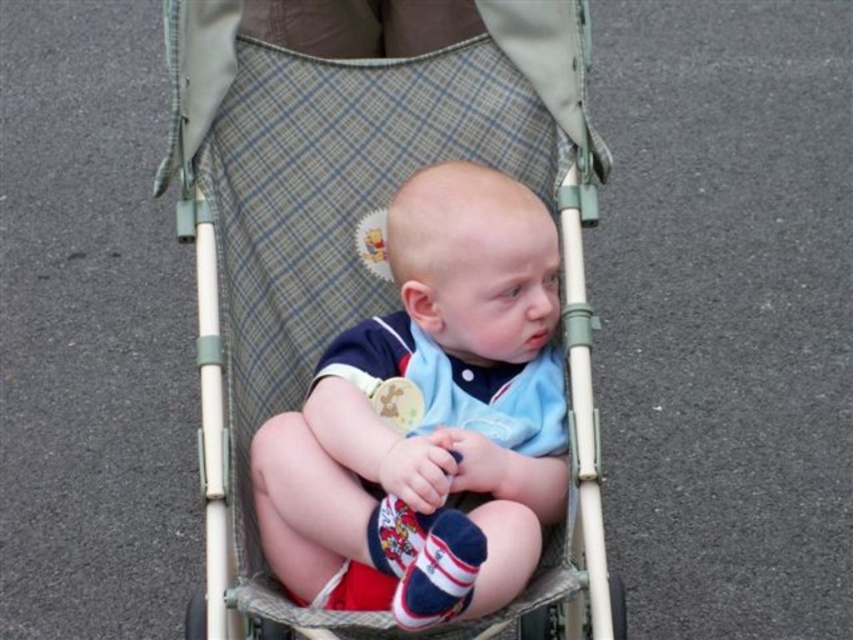
Can you confirm if plaid fabric baby carriage at center is positioned to the right of light blue cotton shirt at center?

Incorrect, plaid fabric baby carriage at center is not on the right side of light blue cotton shirt at center.

Between plaid fabric baby carriage at center and light blue cotton shirt at center, which one appears on the right side from the viewer's perspective?

light blue cotton shirt at center is more to the right.

Where is `plaid fabric baby carriage at center`? The width and height of the screenshot is (853, 640). plaid fabric baby carriage at center is located at coordinates (367, 257).

At what (x,y) coordinates should I click in order to perform the action: click on plaid fabric baby carriage at center. Please return your answer as a coordinate pair (x, y). Looking at the image, I should click on (367, 257).